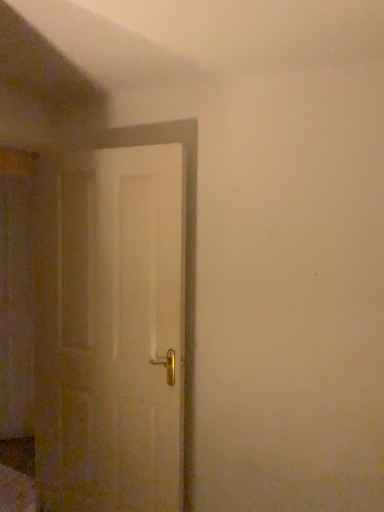
What do you see at coordinates (116, 321) in the screenshot?
I see `white matte door at center` at bounding box center [116, 321].

In order to face white matte door at center, should I rotate leftwards or rightwards?

A 11.357 degree turn to the left will do.

You are a GUI agent. You are given a task and a screenshot of the screen. Output one action in this format:
    pyautogui.click(x=<x>, y=<y>)
    Task: Click on the white matte door at center
    
    Given the screenshot: What is the action you would take?
    pyautogui.click(x=116, y=321)

Identify the location of white matte door at center. (116, 321).